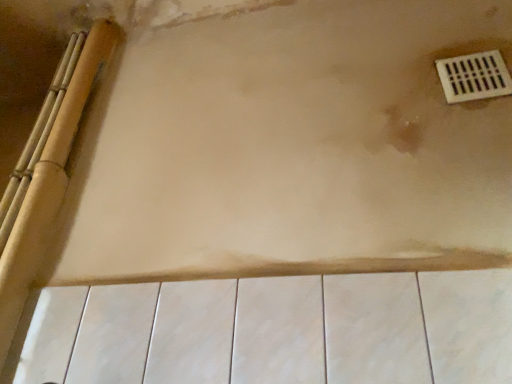
What do you see at coordinates (474, 77) in the screenshot? I see `white plastic vent at upper right` at bounding box center [474, 77].

Where is `white plastic vent at upper right`? white plastic vent at upper right is located at coordinates (474, 77).

You are a GUI agent. You are given a task and a screenshot of the screen. Output one action in this format:
    pyautogui.click(x=<x>, y=<y>)
    Task: Click on the white plastic vent at upper right
    
    Given the screenshot: What is the action you would take?
    pyautogui.click(x=474, y=77)